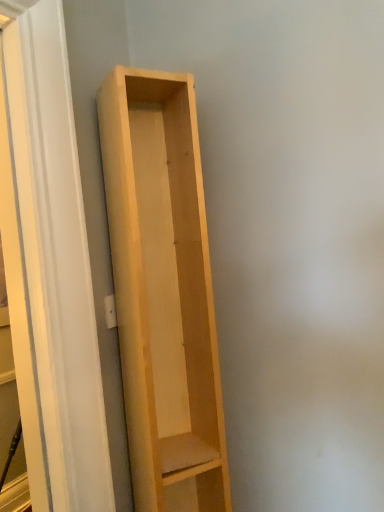
Question: From the image's perspective, relative to natural wood shelf at left, is light wood shelf at center above or below?

Choices:
 (A) below
 (B) above

Answer: (A)

Question: Relative to natural wood shelf at left, is light wood shelf at center in front or behind?

Choices:
 (A) front
 (B) behind

Answer: (B)

Question: Based on their positions, is light wood shelf at center located to the left or right of natural wood shelf at left?

Choices:
 (A) left
 (B) right

Answer: (B)

Question: Considering the positions of natural wood shelf at left and light wood shelf at center in the image, is natural wood shelf at left bigger or smaller than light wood shelf at center?

Choices:
 (A) small
 (B) big

Answer: (A)

Question: Does point (84, 323) appear closer or farther from the camera than point (140, 83)?

Choices:
 (A) closer
 (B) farther

Answer: (A)

Question: Is natural wood shelf at left wider or thinner than light wood shelf at center?

Choices:
 (A) wide
 (B) thin

Answer: (B)

Question: Relative to light wood shelf at center, is natural wood shelf at left in front or behind?

Choices:
 (A) behind
 (B) front

Answer: (B)